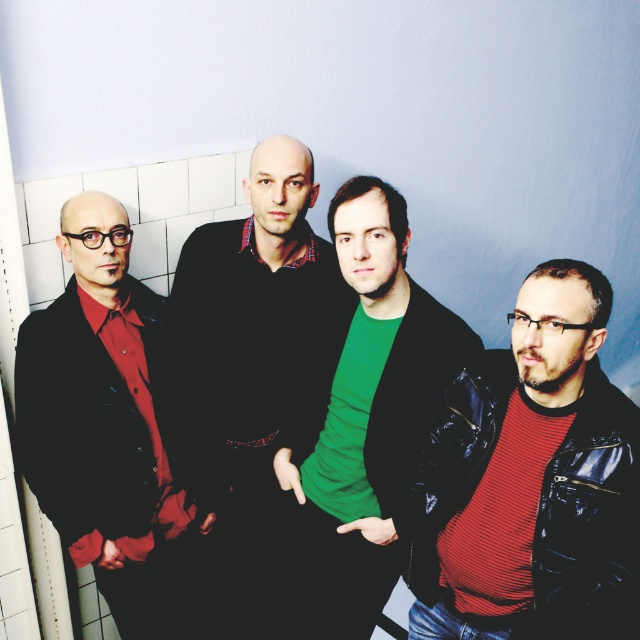
You are standing in a bathroom and see two people wearing the red striped sweater at right and the green matte shirt at center. Which one is more to the right?

The red striped sweater at right is more to the right than the green matte shirt at center.

You are standing in a room with a light blue wall and white tiles. You see a red striped sweater at right and a green matte shirt at center. Which clothing item is nearer to you?

The red striped sweater at right is closer to the viewer than the green matte shirt at center.

You are standing in a bathroom with a light blue wall and white tiles. You see a matte black jacket at left. Where exactly is the matte black jacket located in terms of coordinates?

The matte black jacket at left is located at point 0.667 on the x axis and 0.163 on the y axis.